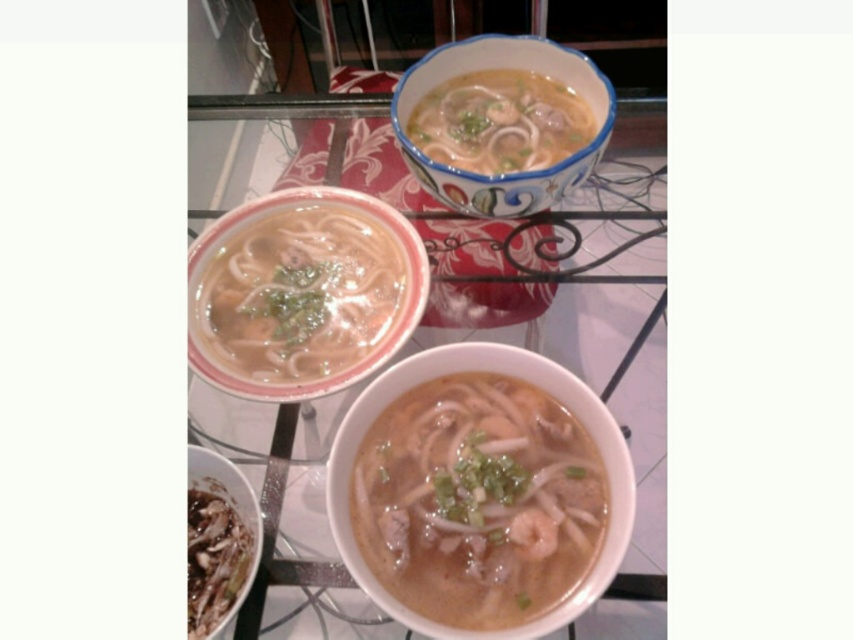
Is the position of white glossy bowl at upper center more distant than that of glassy white table at center?

Yes, white glossy bowl at upper center is behind glassy white table at center.

Does white glossy bowl at upper center have a lesser height compared to glassy white table at center?

Answer: Correct, white glossy bowl at upper center is not as tall as glassy white table at center.

The image size is (853, 640). Describe the element at coordinates (500, 122) in the screenshot. I see `white glossy bowl at upper center` at that location.

Locate an element on the screen. white glossy bowl at upper center is located at coordinates (500, 122).

From the picture: Is decorative ceramic bowl at upper center taller than glassy white table at center?

In fact, decorative ceramic bowl at upper center may be shorter than glassy white table at center.

Does decorative ceramic bowl at upper center have a larger size compared to glassy white table at center?

No, decorative ceramic bowl at upper center is not bigger than glassy white table at center.

Between point (428, 60) and point (198, 100), which one is positioned behind?

Positioned behind is point (198, 100).

Locate an element on the screen. This screenshot has height=640, width=853. decorative ceramic bowl at upper center is located at coordinates (511, 172).

Which is below, decorative ceramic bowl at upper center or white glossy bowl at upper center?

Positioned lower is decorative ceramic bowl at upper center.

Is point (502, 216) behind point (492, 129)?

No, (502, 216) is in front of (492, 129).

Is point (428, 67) positioned after point (457, 108)?

That is False.

Identify the location of decorative ceramic bowl at upper center. This screenshot has width=853, height=640. (511, 172).